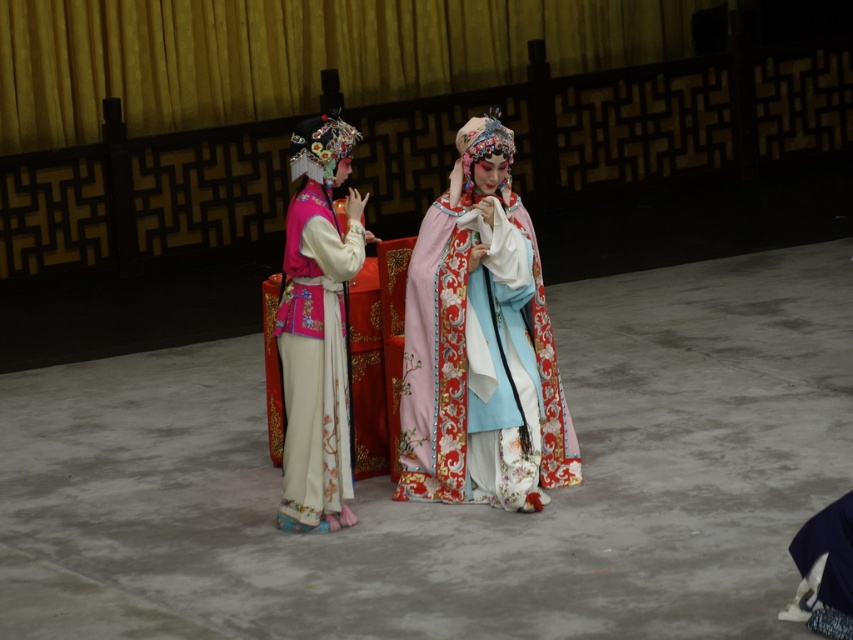
Question: Can you confirm if silky brocade robe at center is positioned below matte pink silk robe at left?

Choices:
 (A) no
 (B) yes

Answer: (A)

Question: Which object appears closest to the camera in this image?

Choices:
 (A) silky brocade robe at center
 (B) matte pink silk robe at left

Answer: (B)

Question: Is silky brocade robe at center wider than matte pink silk robe at left?

Choices:
 (A) yes
 (B) no

Answer: (A)

Question: In this image, where is silky brocade robe at center located relative to matte pink silk robe at left?

Choices:
 (A) left
 (B) right

Answer: (B)

Question: Which object is closer to the camera taking this photo?

Choices:
 (A) silky brocade robe at center
 (B) matte pink silk robe at left

Answer: (B)